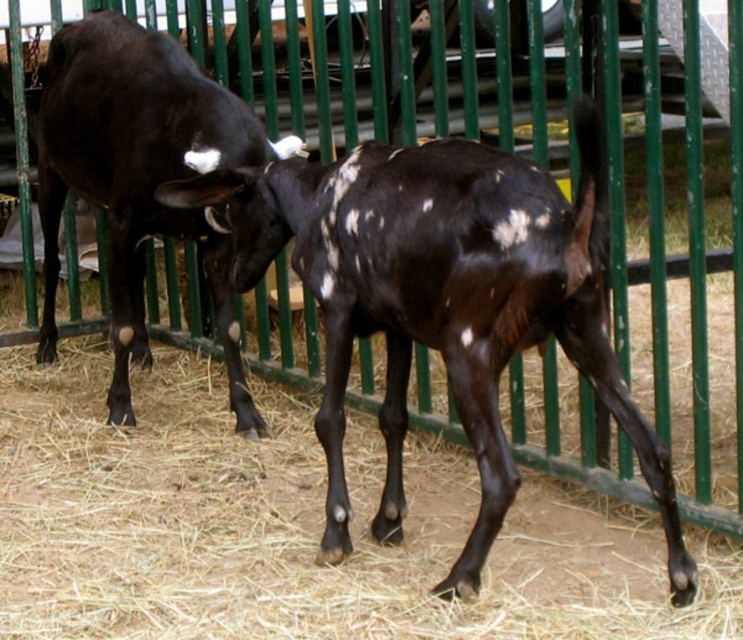
You are a farmer checking the goats in the enclosure. You notice two specific points in the image. The first point is at coordinate (510,522) and the second is at (220,294). Which point is nearer to your view as you look through the camera?

Point (510,522) is closer to the camera than point (220,294).

You are a farmer who needs to place a 36 inch long fence divider between the brown straw at center and the black glossy bull at left. Can you fit it between them?

The brown straw at center and the black glossy bull at left are 36.26 inches apart from each other, so yes, a 36 inch long fence divider can fit between them since it is slightly shorter than the distance between the two objects.

You are a farmer checking the enclosure. You notice the speckled glossy goat at center and the black glossy bull at left. Which animal would require more space in the enclosure for comfortable movement?

The black glossy bull at left requires more space because it is larger than the speckled glossy goat at center.